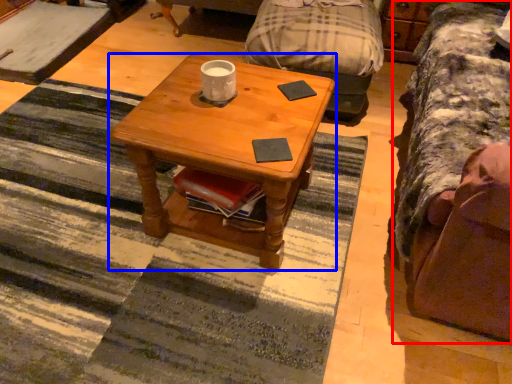
Question: Among these objects, which one is farthest to the camera, studio couch (highlighted by a red box) or coffee table (highlighted by a blue box)?

Choices:
 (A) studio couch
 (B) coffee table

Answer: (B)